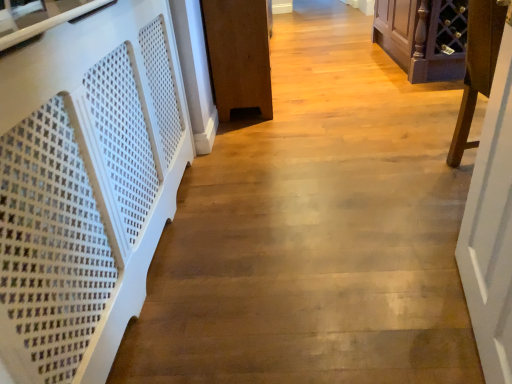
Where is `vacant region below purple wood wine rack at right, marked as the 2th furniture in a right-to-left arrangement (from a real-world perspective)`? This screenshot has width=512, height=384. vacant region below purple wood wine rack at right, marked as the 2th furniture in a right-to-left arrangement (from a real-world perspective) is located at coordinates (455, 175).